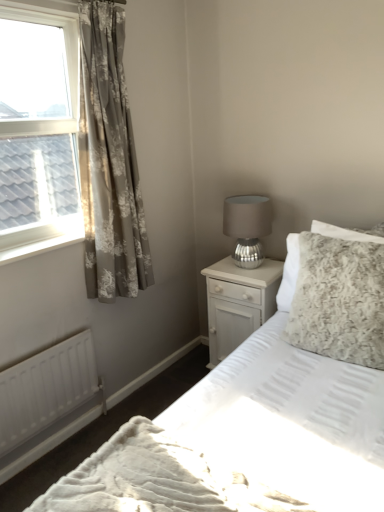
Question: From their relative heights in the image, would you say clear glass window at upper left is taller or shorter than floral-patterned fabric curtain at left?

Choices:
 (A) tall
 (B) short

Answer: (B)

Question: From a real-world perspective, relative to floral-patterned fabric curtain at left, is clear glass window at upper left vertically above or below?

Choices:
 (A) below
 (B) above

Answer: (B)

Question: Which object is positioned farthest from the white textured bed at center?

Choices:
 (A) white painted wood at left
 (B) white glossy nightstand at center-right
 (C) white matte radiator at lower left
 (D) clear glass window at upper left
 (E) floral-patterned fabric curtain at left

Answer: (D)

Question: Which object is the closest to the white glossy nightstand at center-right?

Choices:
 (A) clear glass window at upper left
 (B) white matte radiator at lower left
 (C) floral-patterned fabric curtain at left
 (D) white textured bed at center
 (E) fluffy white pillow at right

Answer: (E)